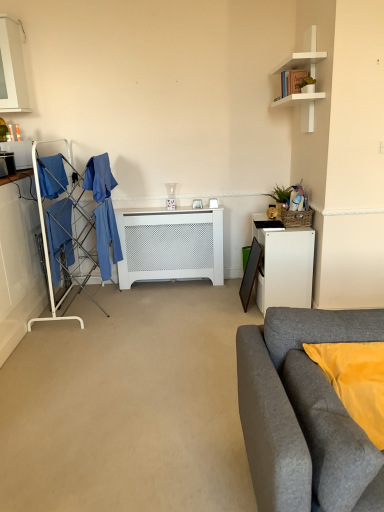
Question: Would you say gray fabric couch at lower right is to the left or to the right of matte black microwave at left in the picture?

Choices:
 (A) left
 (B) right

Answer: (B)

Question: Is gray fabric couch at lower right wider or thinner than matte black microwave at left?

Choices:
 (A) wide
 (B) thin

Answer: (A)

Question: Which of these objects is positioned closest to the white matte radiator at center?

Choices:
 (A) gray fabric couch at lower right
 (B) white matte shelf at upper right
 (C) white glossy cabinet at upper left
 (D) blue fabric drying rack at left
 (E) green woven basket at upper right, which ranks as the second houseplant in front-to-back order

Answer: (D)

Question: Which of these objects is positioned farthest from the white matte shelf at upper right?

Choices:
 (A) white glossy cabinet at upper left
 (B) gray fabric couch at lower right
 (C) white matte radiator at center
 (D) green woven basket at upper right, acting as the first houseplant starting from the back
 (E) white matte desk at right

Answer: (A)